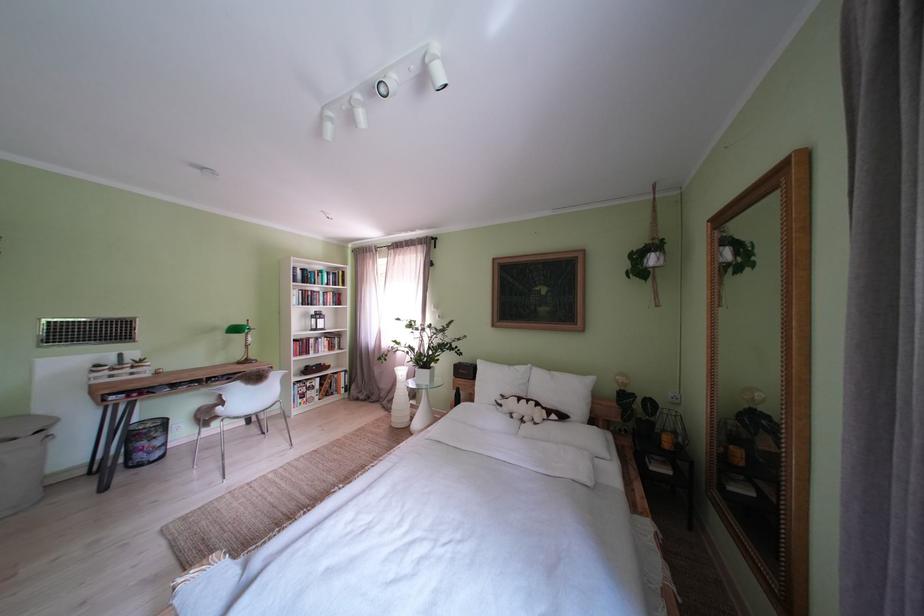
Where would you adjust the ceiling spotlight? Please return your answer as a coordinate pair (x, y).

(383, 86)